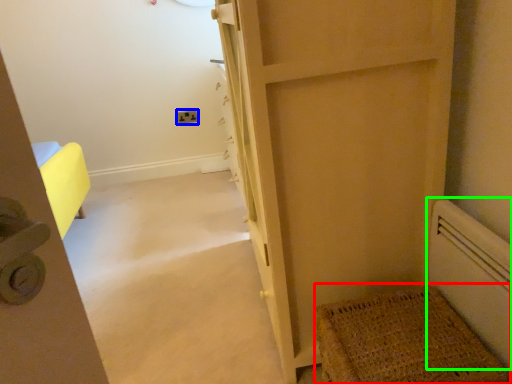
Question: Estimate the real-world distances between objects in this image. Which object is closer to doormat (highlighted by a red box), electric outlet (highlighted by a blue box) or radiator (highlighted by a green box)?

Choices:
 (A) electric outlet
 (B) radiator

Answer: (B)